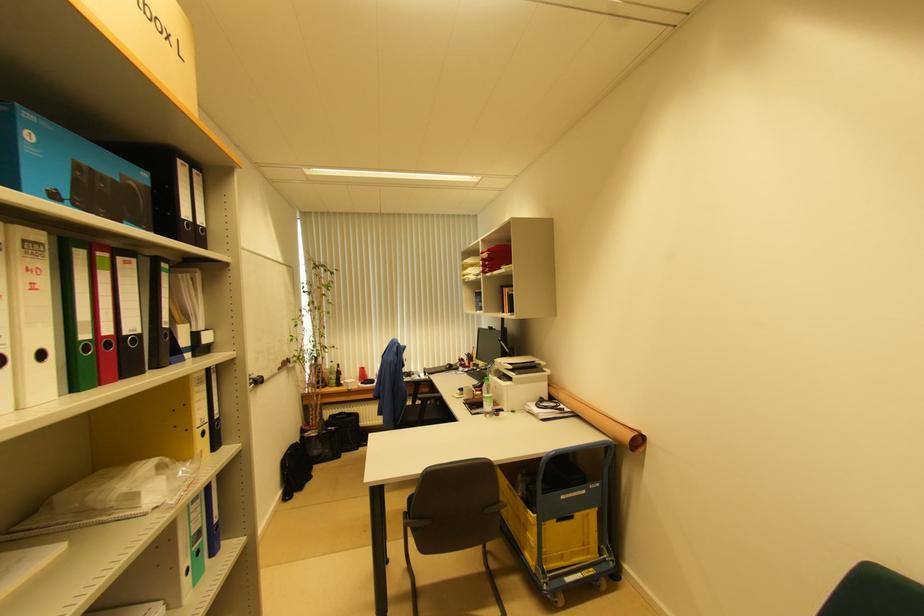
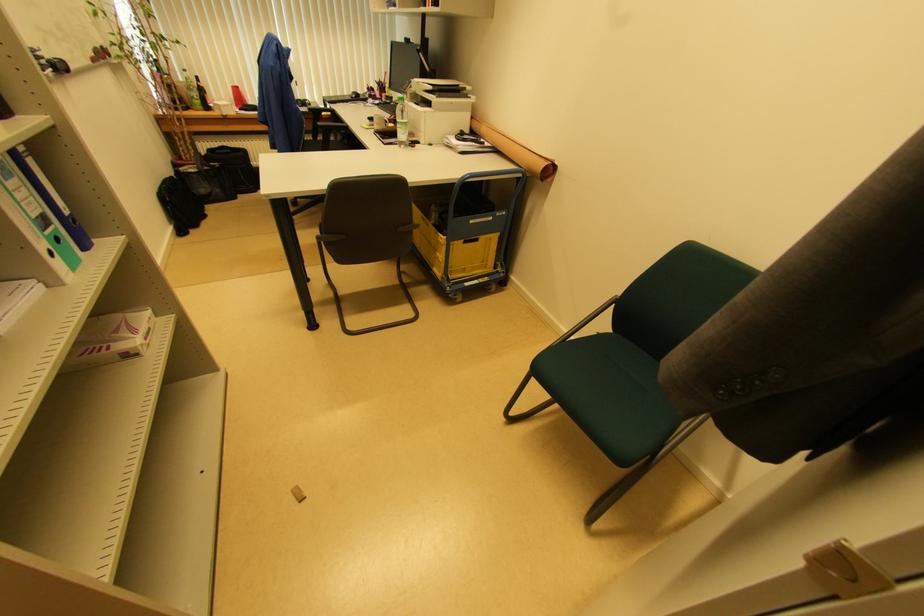
Where in the second image is the point corresponding to (x=528, y=532) from the first image?

(438, 253)